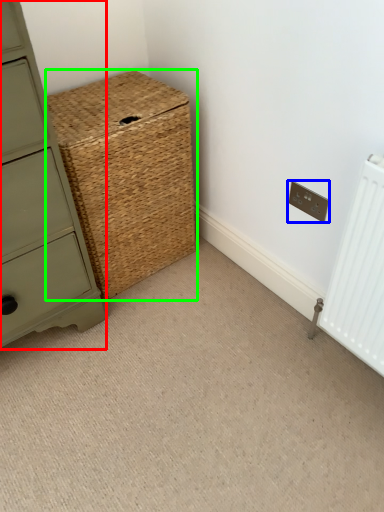
Question: Based on their relative distances, which object is farther from chest of drawers (highlighted by a red box)? Choose from electric outlet (highlighted by a blue box) and basket (highlighted by a green box).

Choices:
 (A) electric outlet
 (B) basket

Answer: (A)